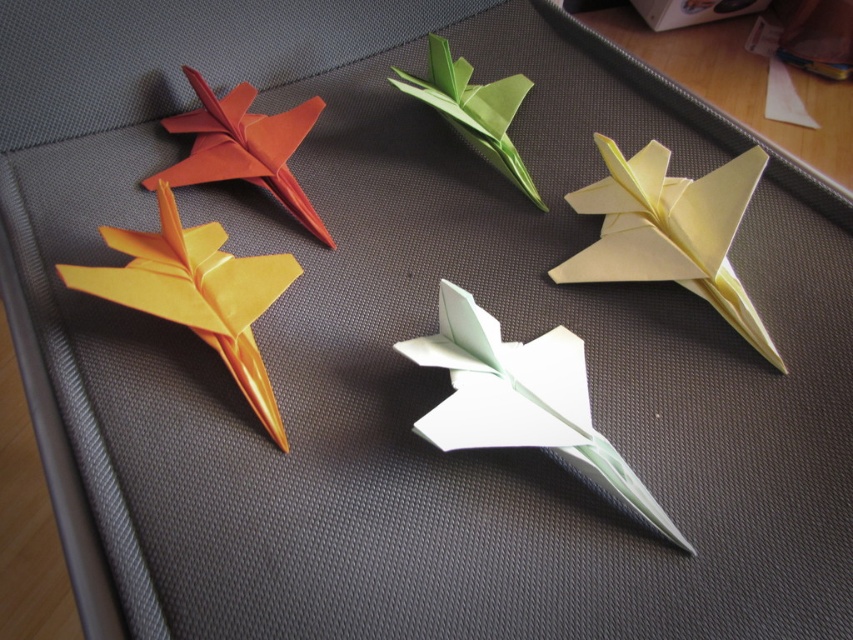
You are an architect designing a model airplane display. You want to place a new airplane exactly where the matte yellow paper airplane at left is currently located. What are the coordinates of that position?

The coordinates of the position where the matte yellow paper airplane at left is located are at point (196, 292).

You are an art student observing the arrangement of the matte yellow paper airplane at left and the white paper at upper right. Which object is positioned nearer to you?

The matte yellow paper airplane at left is closer to the viewer than the white paper at upper right.

You are organizing a display of origami airplanes and need to place a new airplane at the exact location marked by point (196, 292). Which existing airplane should you move to accommodate this new placement?

You should move the matte yellow paper airplane at left, as point (196, 292) marks its current location.